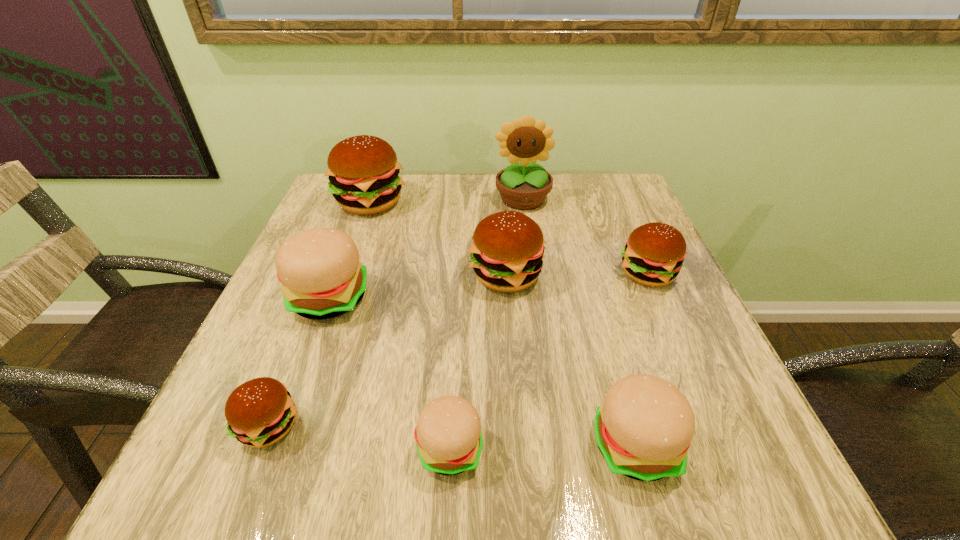
Find the location of a particular element. This screenshot has width=960, height=540. vacant space at the far right corner of the desktop is located at coordinates (593, 204).

Identify the location of blank area at the near right corner. The height and width of the screenshot is (540, 960). (756, 469).

The image size is (960, 540). Find the location of `vacant space in between the second beige hamburger from left to right and the second brown hamburger from right to left`. vacant space in between the second beige hamburger from left to right and the second brown hamburger from right to left is located at coordinates (478, 362).

Find the location of `empty space between the leftmost beige hamburger and the second beige hamburger from right to left`. empty space between the leftmost beige hamburger and the second beige hamburger from right to left is located at coordinates (390, 373).

At what (x,y) coordinates should I click in order to perform the action: click on unoccupied position between the leftmost beige hamburger and the nearest brown hamburger. Please return your answer as a coordinate pair (x, y). Looking at the image, I should click on (299, 362).

Find the location of `empty space between the smallest beige hamburger and the seventh shortest object`. empty space between the smallest beige hamburger and the seventh shortest object is located at coordinates (410, 325).

Image resolution: width=960 pixels, height=540 pixels. In order to click on free space between the farthest beige hamburger and the smallest beige hamburger in this screenshot , I will do `click(390, 373)`.

You are a GUI agent. You are given a task and a screenshot of the screen. Output one action in this format:
    pyautogui.click(x=<x>, y=<y>)
    Task: Click on the blank region between the second beige hamburger from right to left and the biggest beige hamburger
    
    Given the screenshot: What is the action you would take?
    pyautogui.click(x=390, y=373)

At what (x,y) coordinates should I click in order to perform the action: click on vacant space that is in between the farthest beige hamburger and the second biggest brown hamburger. Please return your answer as a coordinate pair (x, y). Looking at the image, I should click on (418, 286).

Locate an element on the screen. vacant area that lies between the leftmost beige hamburger and the third smallest brown hamburger is located at coordinates (418, 286).